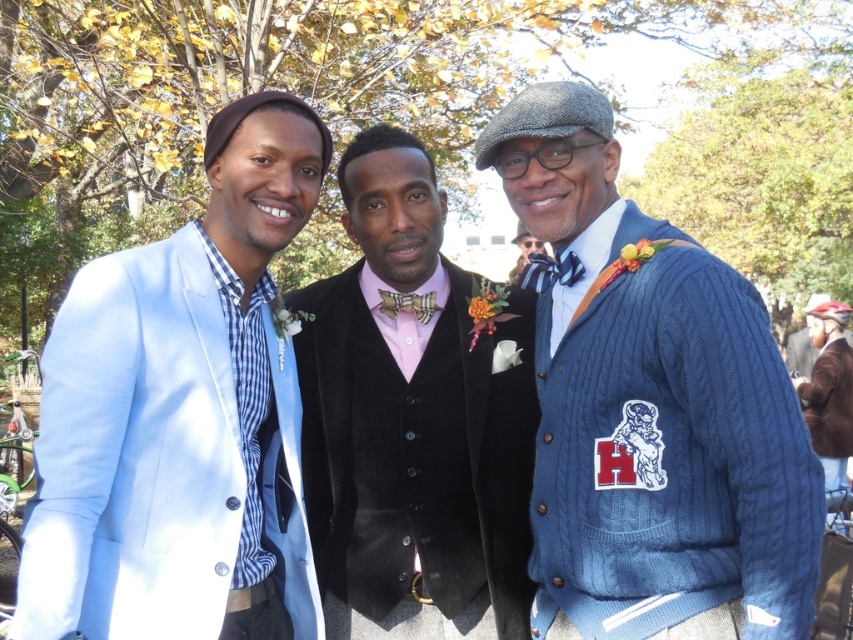
You are a photographer at the event and need to adjust the lighting to highlight both the plaid fabric bow tie at center and the cable knit sweater at center. Since the bow tie is on the left side of the sweater, where should you position the light source to ensure both are well lit?

Position the light source to the left side of the cable knit sweater at center so that it illuminates both the plaid fabric bow tie at center and the sweater effectively.

You are a photographer at the event and need to ensure all attire details are captured clearly. Since you can only focus on one detail at a time, which item should you prioritize to capture in full without needing to adjust your camera frame first, the light blue fabric jacket at left or the plaid fabric bow tie at center?

The light blue fabric jacket at left is wider than the plaid fabric bow tie at center, so you should prioritize capturing the light blue fabric jacket at left first as it requires a wider frame to fit entirely in the shot.